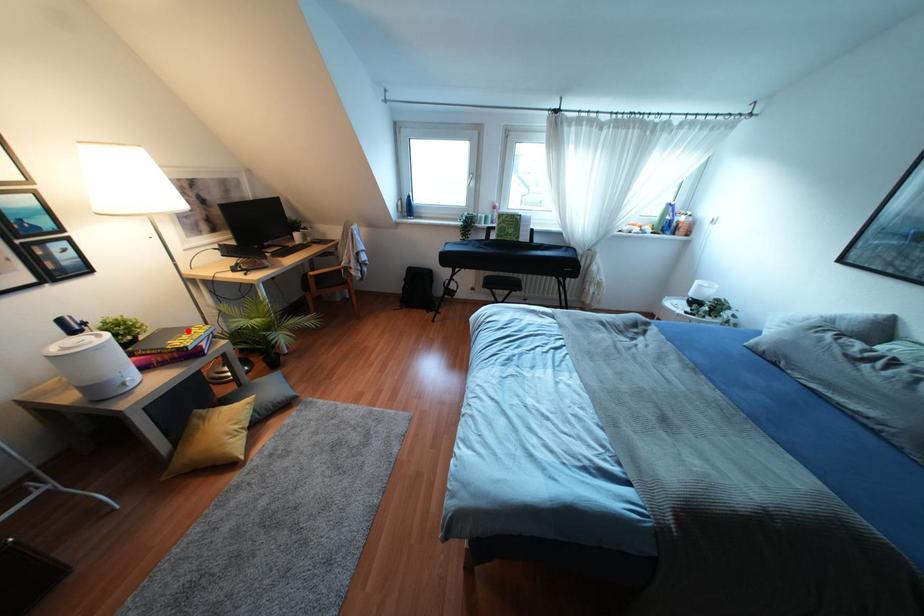
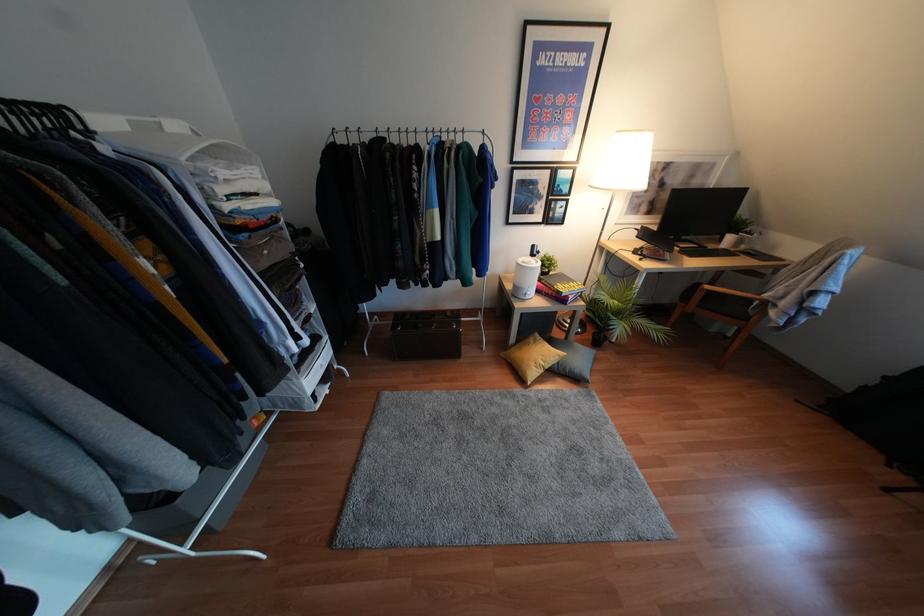
Find the pixel in the second image that matches the highlighted location in the first image.

(570, 283)